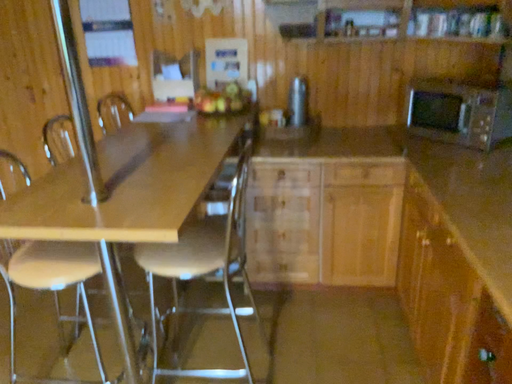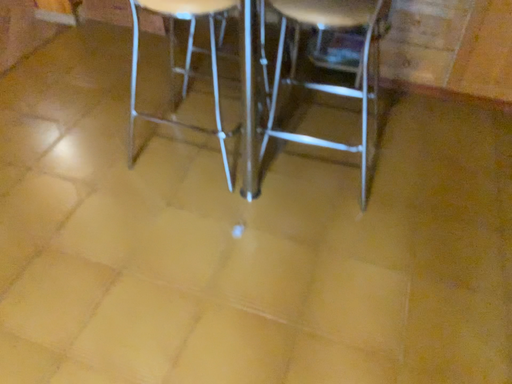
Question: Which way did the camera rotate in the video?

Choices:
 (A) rotated upward
 (B) rotated downward

Answer: (B)